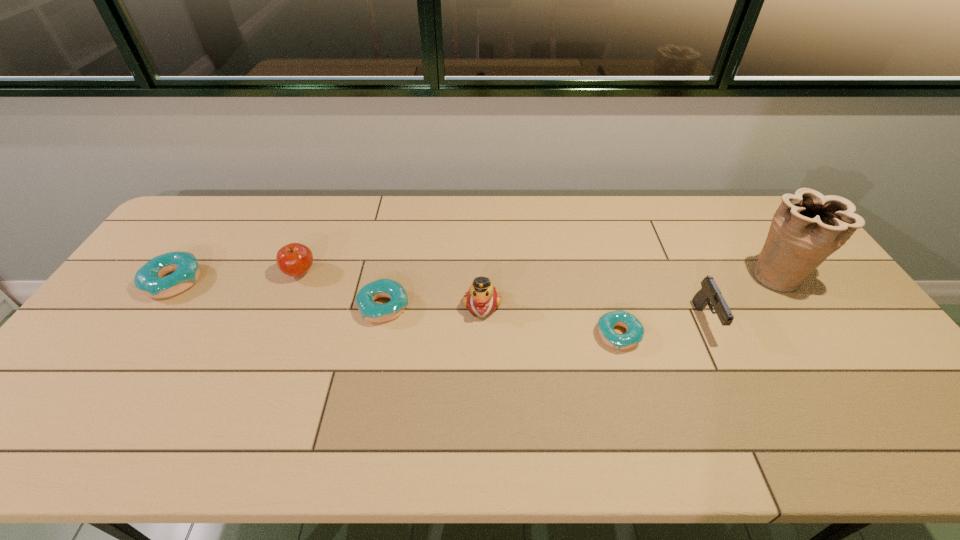
Locate an element on the screen. The image size is (960, 540). free spot between the sixth object from left to right and the shortest doughnut is located at coordinates (662, 328).

Where is `blank region between the duck and the rightmost object`? blank region between the duck and the rightmost object is located at coordinates (631, 291).

Locate an element on the screen. This screenshot has height=540, width=960. free area in between the third object from left to right and the fourth object from left to right is located at coordinates (433, 306).

At what (x,y) coordinates should I click in order to perform the action: click on the closest object to the third object from right to left. Please return your answer as a coordinate pair (x, y). This screenshot has width=960, height=540. Looking at the image, I should click on point(709,292).

Locate which object ranks in proximity to the tallest object. Please provide its 2D coordinates. Your answer should be formatted as a tuple, i.e. [(x, y)], where the tuple contains the x and y coordinates of a point satisfying the conditions above.

[(709, 292)]

I want to click on doughnut identified as the closest to the fifth object from left to right, so pos(375,312).

At what (x,y) coordinates should I click in order to perform the action: click on doughnut that is the second closest to the rightmost doughnut. Please return your answer as a coordinate pair (x, y). Image resolution: width=960 pixels, height=540 pixels. Looking at the image, I should click on (149, 278).

Locate an element on the screen. free space that satisfies the following two spatial constraints: 1. on the back side of the tallest object; 2. on the right side of the second doughnut from left to right is located at coordinates (390, 277).

Image resolution: width=960 pixels, height=540 pixels. What are the coordinates of `vacant space that satisfies the following two spatial constraints: 1. on the front side of the second object from left to right; 2. on the left side of the fifth object from left to right` in the screenshot? It's located at 275,335.

Image resolution: width=960 pixels, height=540 pixels. In order to click on vacant space that satisfies the following two spatial constraints: 1. on the front side of the second tallest doughnut; 2. on the left side of the leftmost doughnut in this screenshot , I will do `click(157, 307)`.